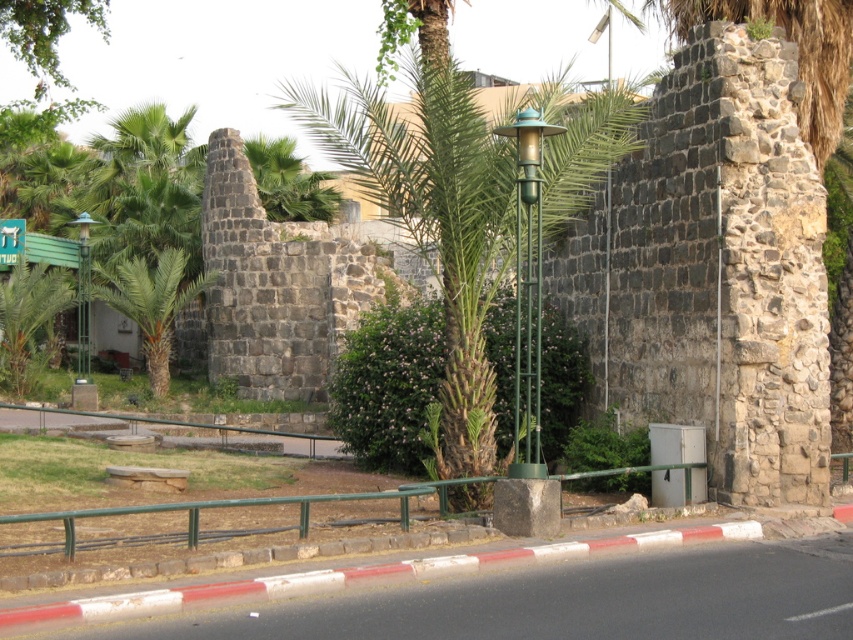
You are standing in front of the historical stone structure and want to place a new decorative item exactly where the green matte lamp post at center is located. What are the coordinates of the spot where you should place it?

The coordinates for the green matte lamp post at center are at point [527,289].

You are a city planner designing a walking path that must maintain a minimum distance of 60 feet between any new structures and existing greenery to comply with environmental regulations. You notice the green matte lamp post at center and the green leafy palm tree at left in the scene. Based on their current positions, can you place a new bench exactly halfway between them without violating the 60 feet rule?

The green matte lamp post at center is 59.37 feet from the green leafy palm tree at left. Placing a bench halfway between them would mean the bench is 29.685 feet from each, which is less than the required 60 feet distance. Therefore, placing the bench would violate the environmental regulations.

You are standing in front of the historical stone structure and want to determine the relative positions of two points marked on the wall. Which point is closer to you, point (483, 161) or point (529, 440)?

Point (483, 161) is further to the viewer than point (529, 440), so the closer point to you is point (529, 440).